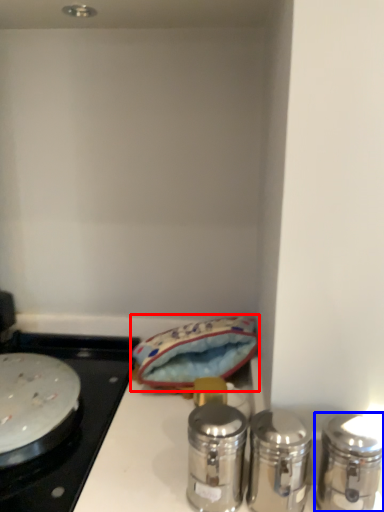
Question: Which object is closer to the camera taking this photo, material (highlighted by a red box) or salt and pepper shakers (highlighted by a blue box)?

Choices:
 (A) material
 (B) salt and pepper shakers

Answer: (B)